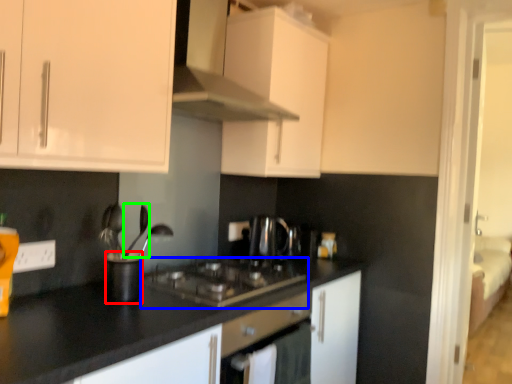
Question: Which is nearer to the appliance (highlighted by a red box)? gas stove (highlighted by a blue box) or silverware (highlighted by a green box).

Choices:
 (A) gas stove
 (B) silverware

Answer: (B)